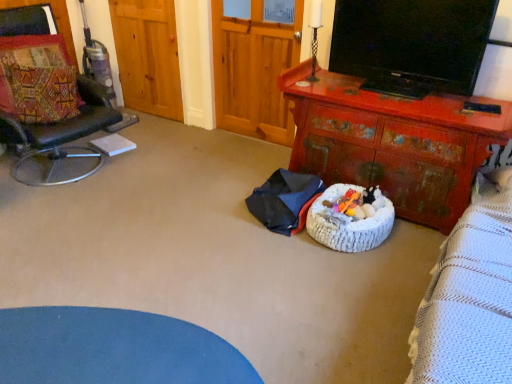
Question: From the image's perspective, is wooden armoire at center located beneath black glossy tv at upper right?

Choices:
 (A) yes
 (B) no

Answer: (B)

Question: Is wooden armoire at center in contact with black glossy tv at upper right?

Choices:
 (A) yes
 (B) no

Answer: (B)

Question: Does wooden armoire at center have a larger size compared to black glossy tv at upper right?

Choices:
 (A) yes
 (B) no

Answer: (A)

Question: Is wooden armoire at center smaller than black glossy tv at upper right?

Choices:
 (A) no
 (B) yes

Answer: (A)

Question: Could you tell me if wooden armoire at center is turned towards black glossy tv at upper right?

Choices:
 (A) yes
 (B) no

Answer: (B)

Question: Considering the relative positions of wooden armoire at center and plush multicolored toy at center in the image provided, is wooden armoire at center to the left or to the right of plush multicolored toy at center?

Choices:
 (A) left
 (B) right

Answer: (A)

Question: Is wooden armoire at center bigger or smaller than plush multicolored toy at center?

Choices:
 (A) big
 (B) small

Answer: (A)

Question: Is point (272, 39) closer or farther from the camera than point (352, 211)?

Choices:
 (A) farther
 (B) closer

Answer: (A)

Question: Is wooden armoire at center in front of or behind plush multicolored toy at center in the image?

Choices:
 (A) behind
 (B) front

Answer: (A)

Question: Is rusty wood desk at center taller or shorter than patchwork fabric pillow at left?

Choices:
 (A) short
 (B) tall

Answer: (B)

Question: From the image's perspective, is rusty wood desk at center positioned above or below patchwork fabric pillow at left?

Choices:
 (A) above
 (B) below

Answer: (B)

Question: Based on their positions, is rusty wood desk at center located to the left or right of patchwork fabric pillow at left?

Choices:
 (A) left
 (B) right

Answer: (B)

Question: Does point (338, 132) appear closer or farther from the camera than point (22, 54)?

Choices:
 (A) farther
 (B) closer

Answer: (B)

Question: Considering the positions of point (423, 183) and point (266, 74), is point (423, 183) closer or farther from the camera than point (266, 74)?

Choices:
 (A) closer
 (B) farther

Answer: (A)

Question: In terms of height, does rusty wood desk at center look taller or shorter compared to wooden armoire at center?

Choices:
 (A) tall
 (B) short

Answer: (B)